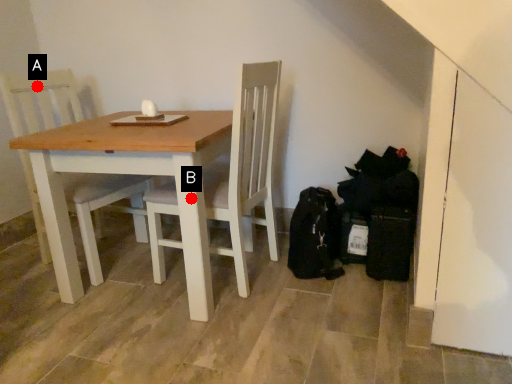
Question: Two points are circled on the image, labeled by A and B beside each circle. Which point is closer to the camera?

Choices:
 (A) A is closer
 (B) B is closer

Answer: (B)